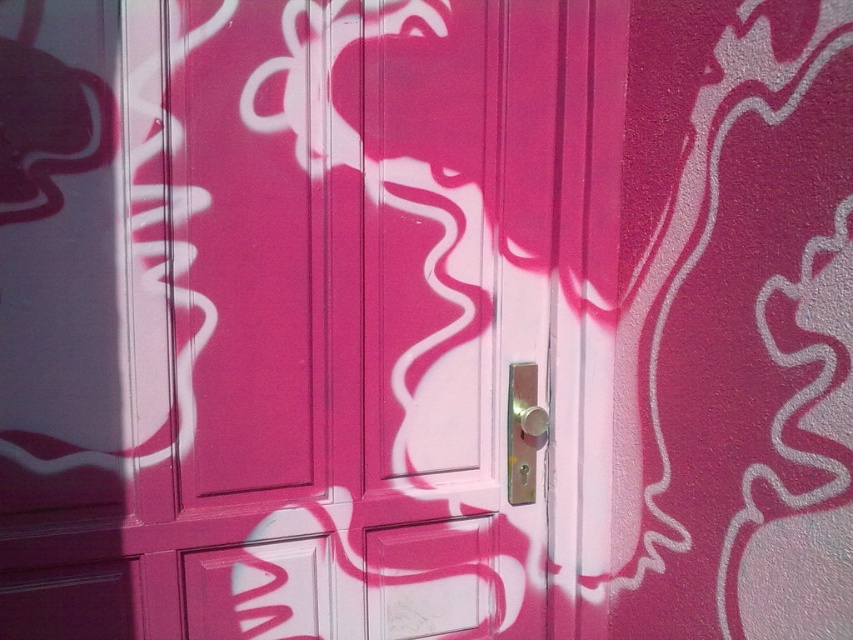
Question: Considering the relative positions of matte pink door at center and metallic gold door handle at center in the image provided, where is matte pink door at center located with respect to metallic gold door handle at center?

Choices:
 (A) below
 (B) above

Answer: (B)

Question: Among these objects, which one is nearest to the camera?

Choices:
 (A) matte pink door at center
 (B) metallic gold door handle at center

Answer: (A)

Question: Can you confirm if matte pink door at center is wider than metallic gold door handle at center?

Choices:
 (A) yes
 (B) no

Answer: (A)

Question: Where is matte pink door at center located in relation to metallic gold door handle at center in the image?

Choices:
 (A) left
 (B) right

Answer: (A)

Question: Which point is closer to the camera?

Choices:
 (A) metallic gold door handle at center
 (B) matte pink door at center

Answer: (B)